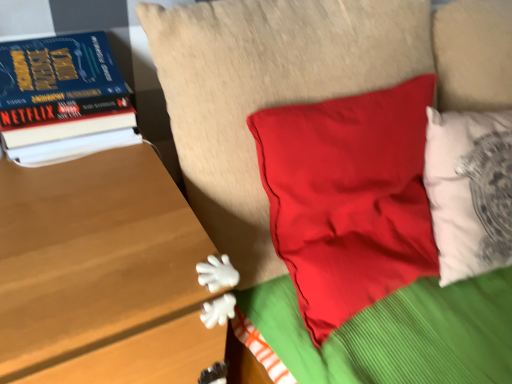
Find the location of a particular element. The image size is (512, 384). vacant space situated above wooden table at left (from a real-world perspective) is located at coordinates (82, 200).